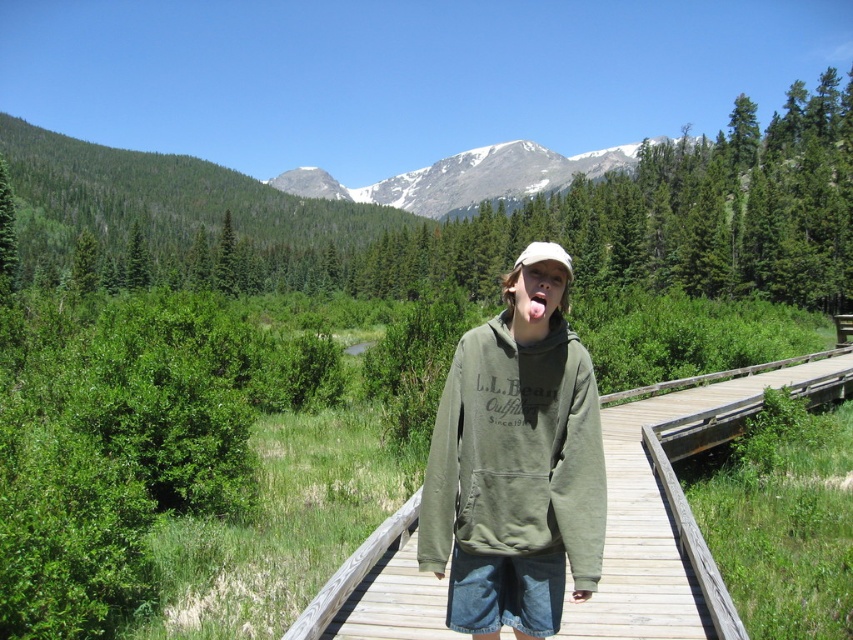
You are a hiker planning to take a photo of the wooden at center and snowy granite mountain at upper center in the background. Given that your camera can focus on objects up to 250 meters away, will you be able to capture both subjects clearly in one shot?

The wooden at center and snowy granite mountain at upper center are 269.68 meters apart from each other. Since the camera can only focus up to 250 meters, the distance between them exceeds the camera range. Therefore, you won

Based on the scene described, can you determine which object is taller between the olive green hoodie at center and the snowy granite mountain at upper center?

The snowy granite mountain at upper center is taller than the olive green hoodie at center.

You are standing at the point marked by the coordinates point (642,580) and want to walk towards the point marked by point (529,186). Given that the boardwalk you are on is 1.2 meters wide, will you have to move sideways to stay on the boardwalk while walking towards your destination?

Since point (642,580) is closer to the viewer than point (529,186), you will need to move sideways to stay on the boardwalk while walking towards point (529,186) because the boardwalk narrows or changes direction at that point.